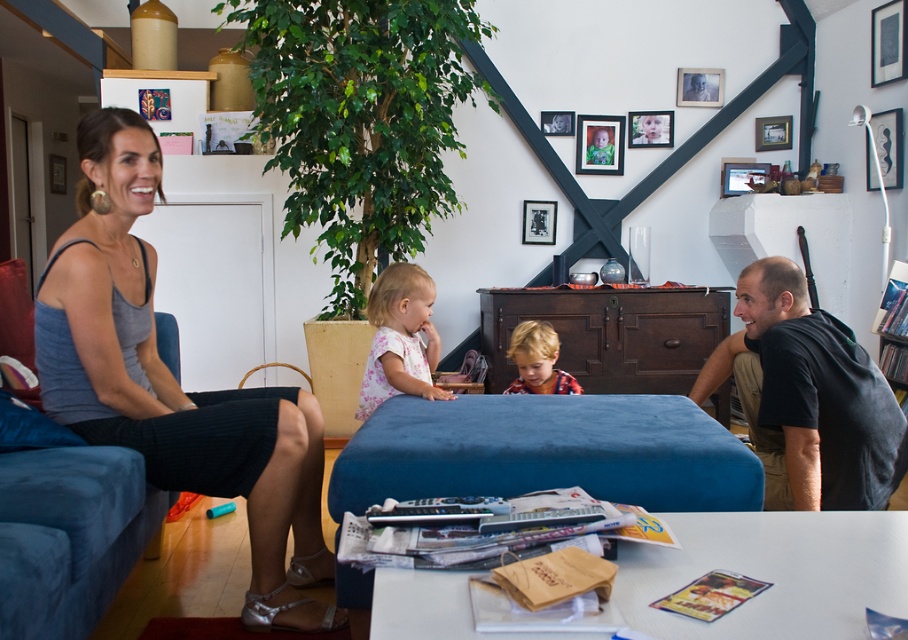
You are organizing a charity clothing drive and have a box that can only hold items wider than 20 inches. You find both the floral cotton shirt at center and the plaid cotton shirt at center. Which shirt should you place in the box based on their widths?

The floral cotton shirt at center should be placed in the box because its width surpasses the plaid cotton shirt at center, and if the plaid cotton shirt is wider than 20 inches, then the floral one would also qualify. However, without specific measurements, we can only confirm that the floral shirt is wider than the plaid one. If the plaid shirt meets the 20 inches requirement, the floral shirt would automatically fit the criteria as well.

You are a photographer setting up a shoot in this living room. You need to position a small lamp between the matte gray tank top at left and the blue fabric couch at left. Based on their positions, where should the lamp be placed?

The lamp should be placed between the matte gray tank top at left and the blue fabric couch at left, since the matte gray tank top at left is located above the blue fabric couch at left, so the lamp can be positioned below the matte gray tank top at left but above the blue fabric couch at left to maintain the spatial arrangement.